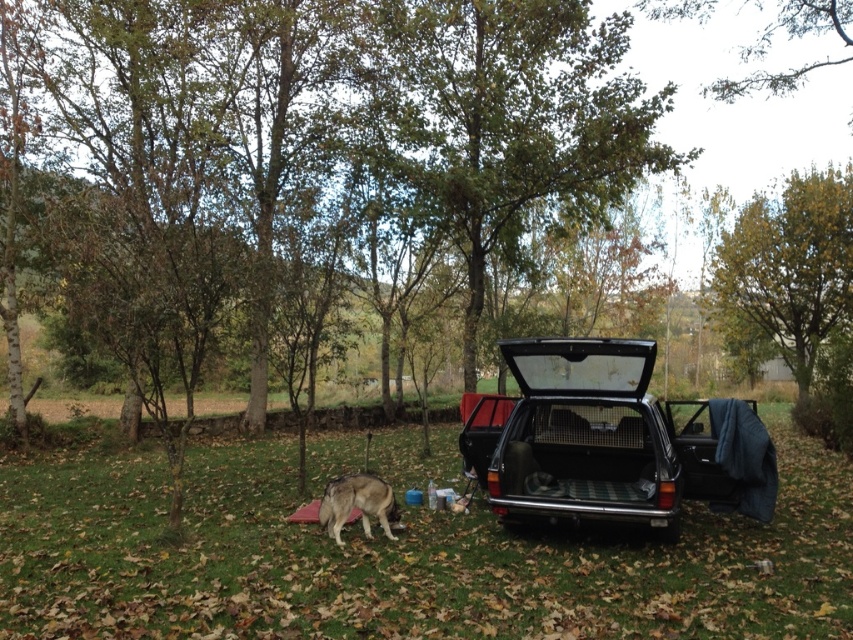
You are a photographer setting up a tripod in this scene. You need to position the tripod so that both the black matte car at right and the fuzzy brown dog at lower left are visible in the frame. Given their sizes, which object should you place closer to the center of the frame to ensure both are fully visible?

The black matte car at right is larger in size than the fuzzy brown dog at lower left. To ensure both are fully visible, you should position the larger object, the black matte car at right, closer to the center of the frame.

Looking at this image, you are a hiker who needs to move your backpack from the black matte car at right to the fuzzy brown dog at lower left. Which direction should you move it to ensure it reaches the dog?

The black matte car at right is positioned on the right side of the fuzzy brown dog at lower left, so you should move the backpack to the left to reach the dog.